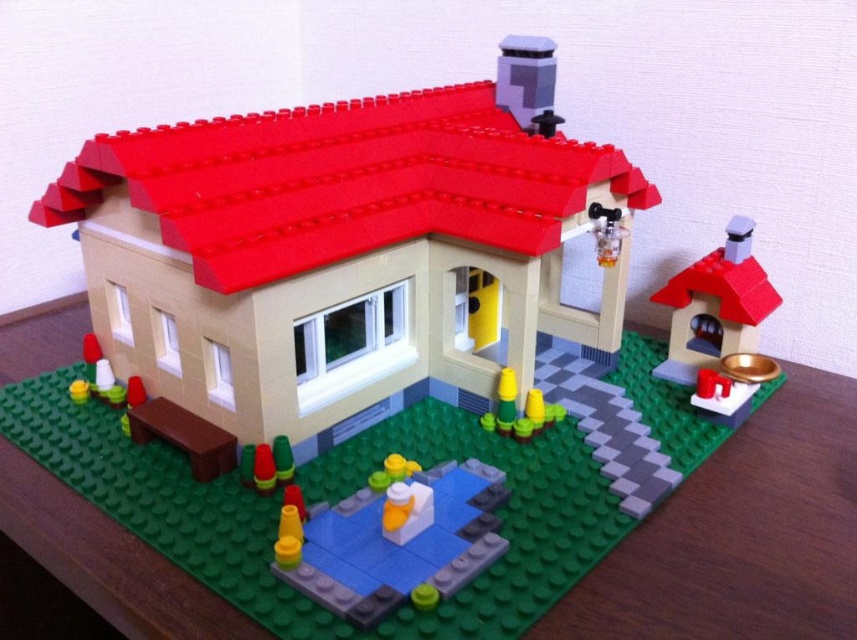
You are a child playing with LEGO. You see the smooth plastic duck at center and the shiny gold bowl at right. Which object is closer to the ground?

The smooth plastic duck at center is closer to the ground because it is below the shiny gold bowl at right.

You are a child who wants to put the smooth plastic duck at center into the shiny gold bowl at right. Can the duck fit inside the bowl?

The smooth plastic duck at center is smaller than the shiny gold bowl at right, so yes, the duck can fit inside the bowl.